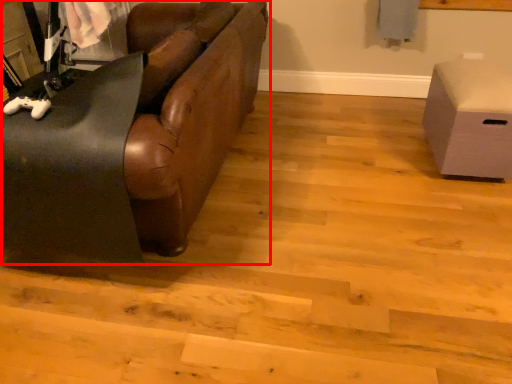
Question: From the image's perspective, where is studio couch (annotated by the red box) located in relation to furniture in the image?

Choices:
 (A) below
 (B) above

Answer: (B)